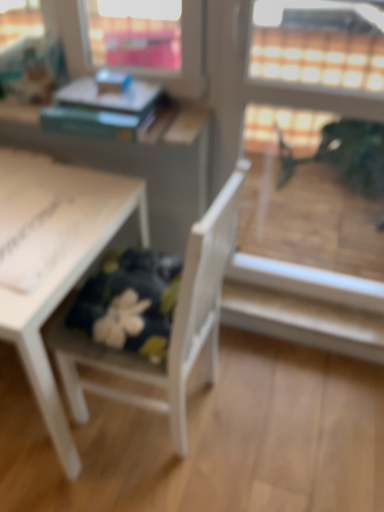
Locate an element on the screen. The image size is (384, 512). vacant space underneath white wood chair at lower left (from a real-world perspective) is located at coordinates (165, 412).